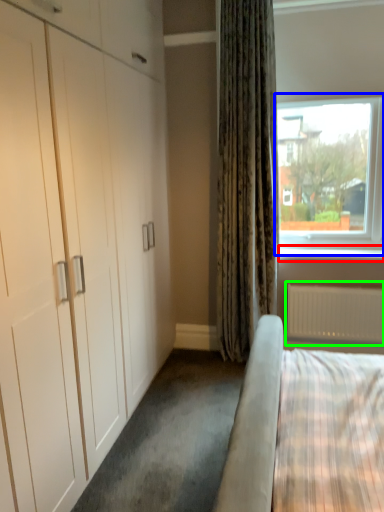
Question: Which object is the closest to the window sill (highlighted by a red box)? Choose among these: window (highlighted by a blue box) or radiator (highlighted by a green box).

Choices:
 (A) window
 (B) radiator

Answer: (B)